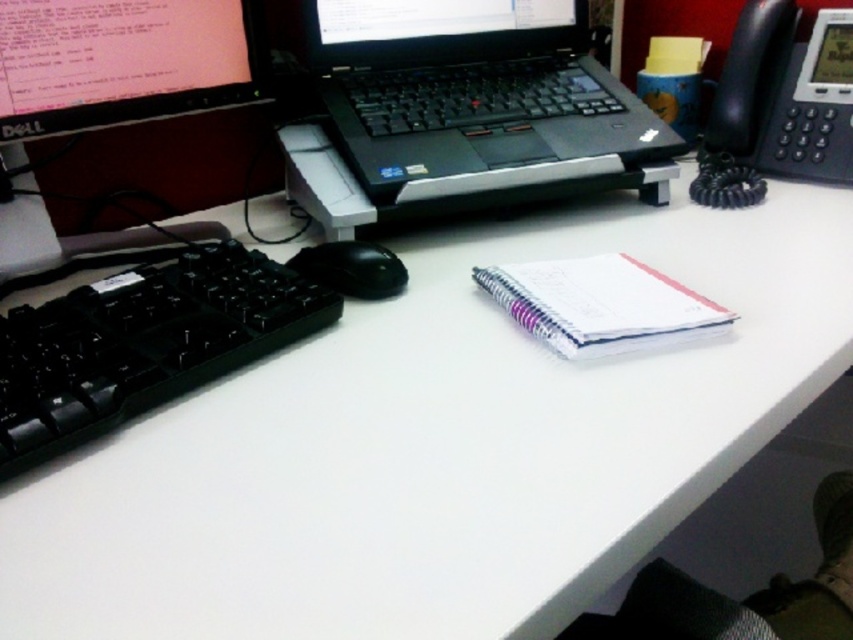
Does black plastic laptop at center lie in front of black plastic phone at upper right?

That is True.

Does point (469, 113) lie in front of point (805, 172)?

That is True.

Locate an element on the screen. This screenshot has height=640, width=853. black plastic laptop at center is located at coordinates (473, 97).

Does black plastic phone at upper right have a lesser width compared to black matte mouse at left?

In fact, black plastic phone at upper right might be wider than black matte mouse at left.

Does point (762, 120) come closer to viewer compared to point (314, 262)?

That is False.

Between point (711, 193) and point (322, 275), which one is positioned in front?

Positioned in front is point (322, 275).

Locate an element on the screen. The image size is (853, 640). black plastic phone at upper right is located at coordinates (778, 106).

Is point (490, 13) more distant than point (585, 355)?

That is True.

Image resolution: width=853 pixels, height=640 pixels. I want to click on black plastic laptop at center, so click(473, 97).